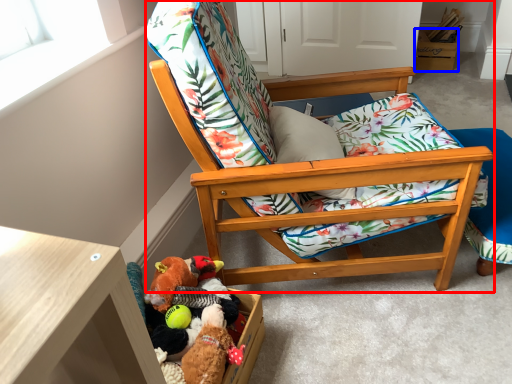
Question: Which object appears closest to the camera in this image, chair (highlighted by a red box) or storage box (highlighted by a blue box)?

Choices:
 (A) chair
 (B) storage box

Answer: (A)